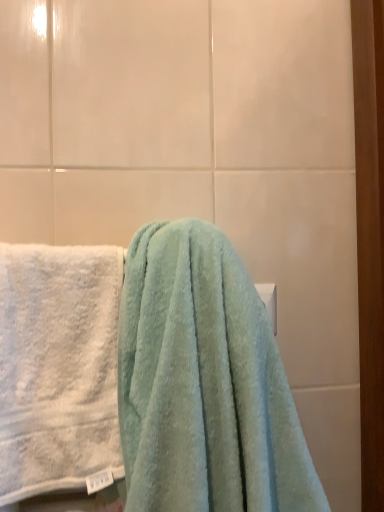
Question: From the image's perspective, is soft blue towel at center, the first towel from the right, located above or below white matte towel bar at upper center?

Choices:
 (A) above
 (B) below

Answer: (B)

Question: In terms of height, does soft blue towel at center, the 2th towel viewed from the left, look taller or shorter compared to white matte towel bar at upper center?

Choices:
 (A) tall
 (B) short

Answer: (A)

Question: Considering the real-world distances, which object is closest to the white matte towel bar at upper center?

Choices:
 (A) soft blue towel at center, the 2th towel viewed from the left
 (B) white fluffy towel at left, which is the first towel from left to right

Answer: (A)

Question: Which object is the closest to the white fluffy towel at left, which is the first towel from left to right?

Choices:
 (A) white matte towel bar at upper center
 (B) soft blue towel at center, the 2th towel viewed from the left

Answer: (B)